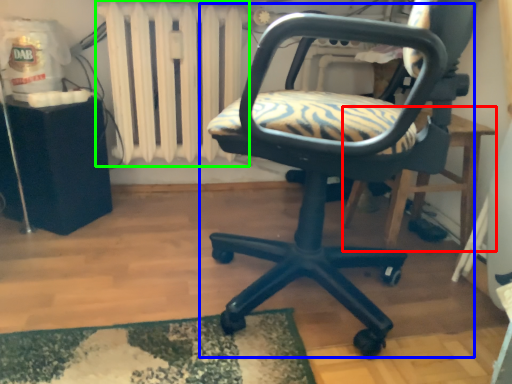
Question: Which object is positioned closest to table (highlighted by a red box)? Select from chair (highlighted by a blue box) and radiator (highlighted by a green box).

Choices:
 (A) chair
 (B) radiator

Answer: (A)